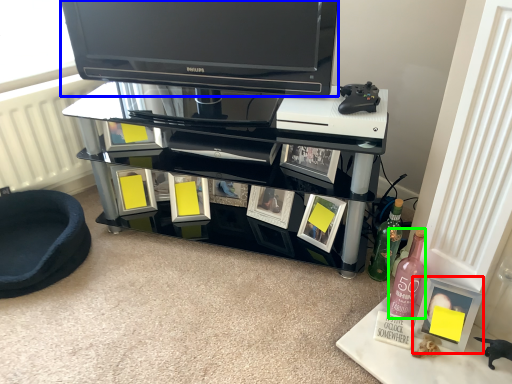
Question: Considering the real-world distances, which object is closest to picture frame (highlighted by a red box)? television (highlighted by a blue box) or bottle (highlighted by a green box).

Choices:
 (A) television
 (B) bottle

Answer: (B)